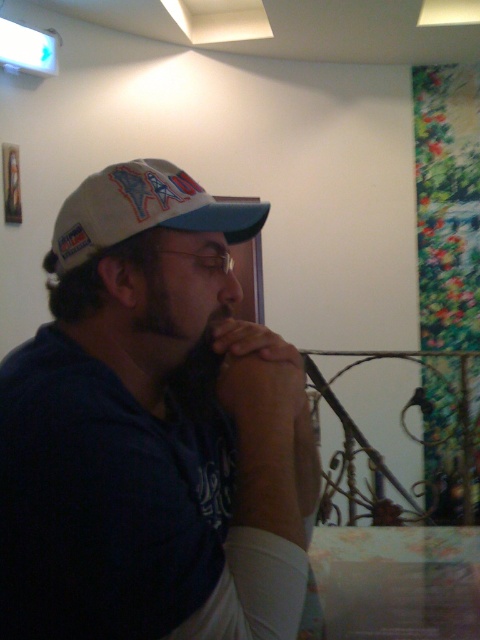
You are an artist observing the man in the image. You need to paint a portrait focusing on the white fabric shirt at center and the matte skin jaw at center. Which object should you paint first if you want to start with the larger one?

The white fabric shirt at center is bigger than the matte skin jaw at center, so you should paint the white fabric shirt at center first.

Based on the photo, based on the scene description, can you determine if the white fabric shirt at center is wider than the matte skin jaw at center?

The white fabric shirt at center might be wider than matte skin jaw at center according to the description.